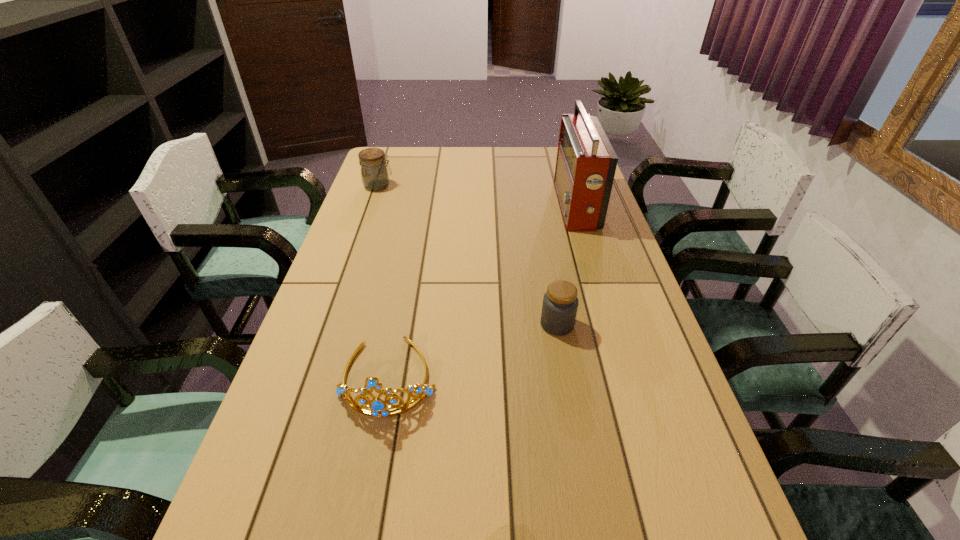
You are a GUI agent. You are given a task and a screenshot of the screen. Output one action in this format:
    pyautogui.click(x=<x>, y=<y>)
    Task: Click on the vacant area situated 0.260m on the front-facing side of the radio receiver
    The image size is (960, 540).
    Given the screenshot: What is the action you would take?
    pyautogui.click(x=482, y=206)

This screenshot has width=960, height=540. Identify the location of free location located 0.140m on the lid of the farther jar. (431, 186).

Locate an element on the screen. This screenshot has width=960, height=540. vacant space situated 0.060m on the front-facing side of the tiara is located at coordinates (375, 448).

At what (x,y) coordinates should I click in order to perform the action: click on free location located on the surface of the third farthest object near the warning symbol. Please return your answer as a coordinate pair (x, y). The width and height of the screenshot is (960, 540). Looking at the image, I should click on (500, 325).

Find the location of a particular element. The width and height of the screenshot is (960, 540). vacant area located on the surface of the third farthest object near the warning symbol is located at coordinates (382, 325).

Locate an element on the screen. The image size is (960, 540). vacant space located on the surface of the third farthest object near the warning symbol is located at coordinates (418, 325).

At what (x,y) coordinates should I click in order to perform the action: click on jar located in the left edge section of the desktop. Please return your answer as a coordinate pair (x, y). Looking at the image, I should click on (374, 173).

Image resolution: width=960 pixels, height=540 pixels. In order to click on tiara at the left edge in this screenshot , I will do `click(379, 408)`.

Image resolution: width=960 pixels, height=540 pixels. Find the location of `object positioned at the right edge`. object positioned at the right edge is located at coordinates (586, 162).

What are the coordinates of `free spot at the far edge of the desktop` in the screenshot? It's located at (530, 173).